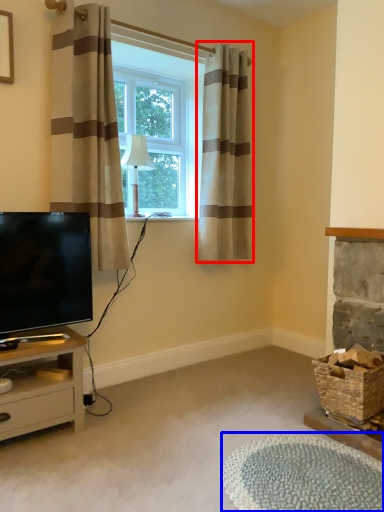
Question: Which object is closer to the camera taking this photo, curtain (highlighted by a red box) or plain (highlighted by a blue box)?

Choices:
 (A) curtain
 (B) plain

Answer: (B)